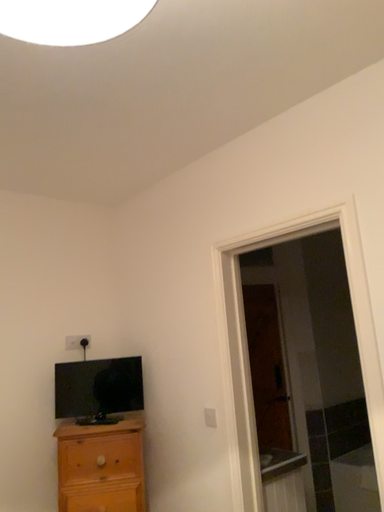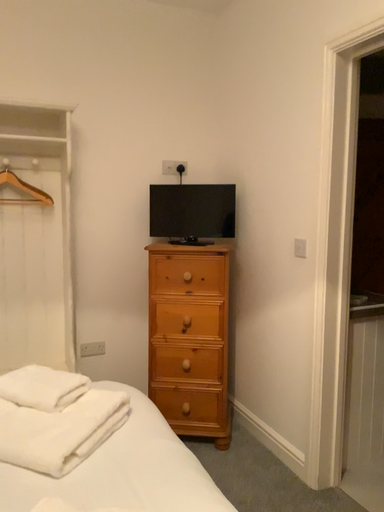
Question: Which way did the camera rotate in the video?

Choices:
 (A) rotated upward
 (B) rotated downward

Answer: (B)